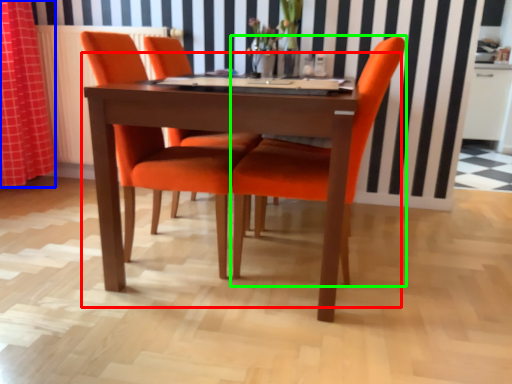
Question: Which object is positioned closest to kitchen & dining room table (highlighted by a red box)? Select from curtain (highlighted by a blue box) and chair (highlighted by a green box).

Choices:
 (A) curtain
 (B) chair

Answer: (B)